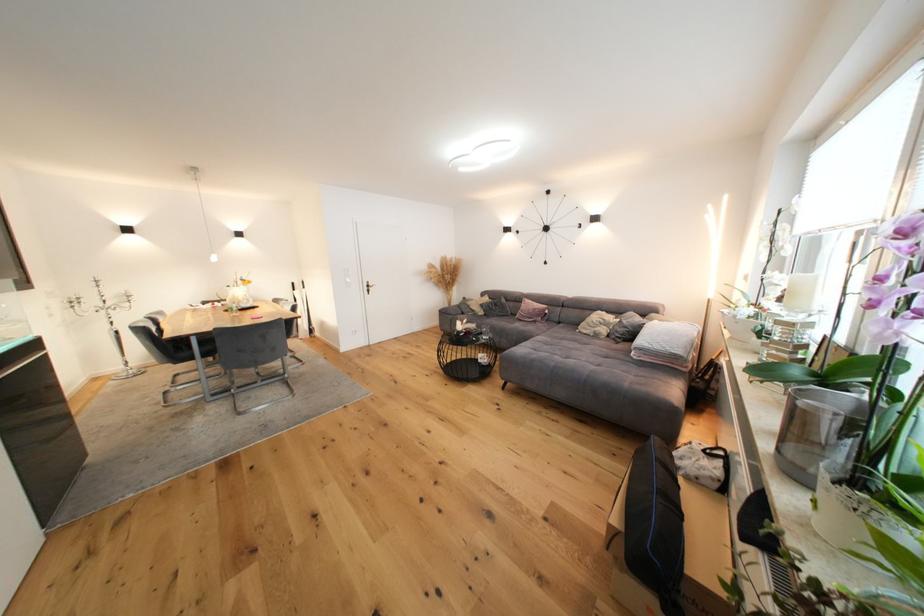
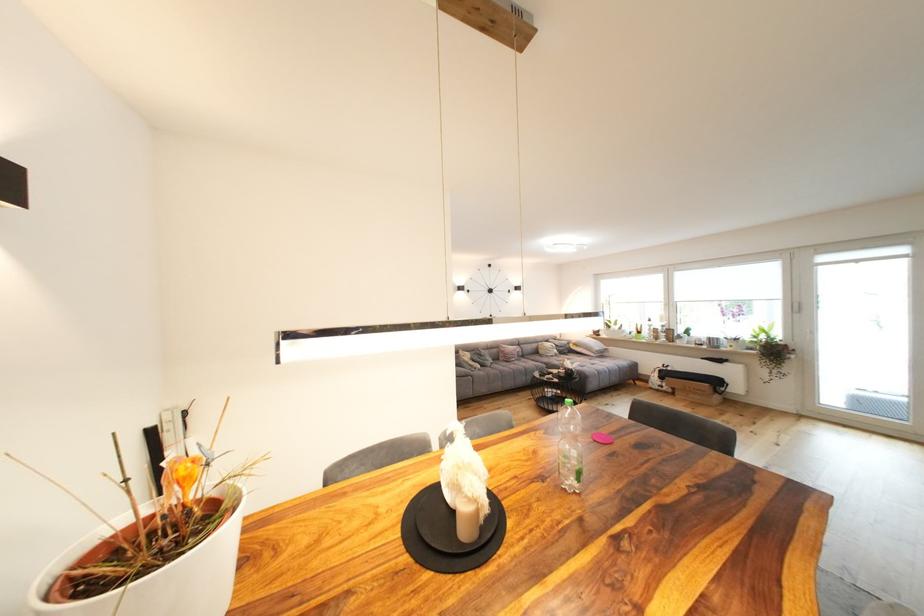
In the second image, find the point that corresponds to (x=611, y=331) in the first image.

(563, 353)